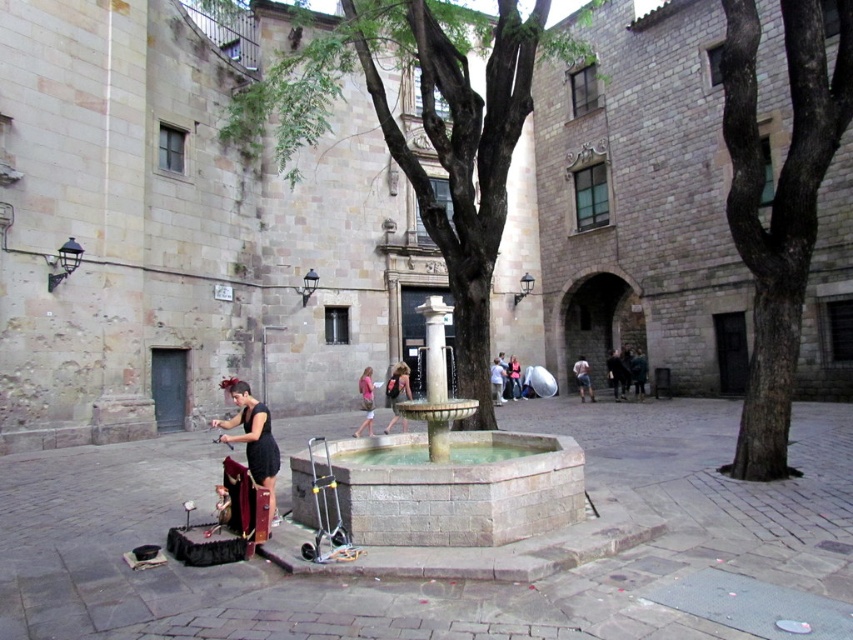
Is smooth gray bark at center shorter than stone fountain at center?

No.

What do you see at coordinates (778, 205) in the screenshot? This screenshot has height=640, width=853. I see `smooth gray bark at center` at bounding box center [778, 205].

Image resolution: width=853 pixels, height=640 pixels. What do you see at coordinates (778, 205) in the screenshot? I see `smooth gray bark at center` at bounding box center [778, 205].

The image size is (853, 640). Identify the location of smooth gray bark at center. (778, 205).

Does green leafy tree at center have a lesser height compared to matte black dress at center?

No, green leafy tree at center is not shorter than matte black dress at center.

The height and width of the screenshot is (640, 853). What do you see at coordinates (424, 131) in the screenshot? I see `green leafy tree at center` at bounding box center [424, 131].

Image resolution: width=853 pixels, height=640 pixels. What do you see at coordinates (424, 131) in the screenshot?
I see `green leafy tree at center` at bounding box center [424, 131].

Find the location of a particular element. This screenshot has height=640, width=853. green leafy tree at center is located at coordinates (424, 131).

Does black fabric street artist at center appear on the left side of pink fabric dress at center?

Yes, black fabric street artist at center is to the left of pink fabric dress at center.

Between black fabric street artist at center and pink fabric dress at center, which one appears on the left side from the viewer's perspective?

black fabric street artist at center

I want to click on black fabric street artist at center, so click(x=252, y=436).

Locate an element on the screen. The height and width of the screenshot is (640, 853). black fabric street artist at center is located at coordinates (252, 436).